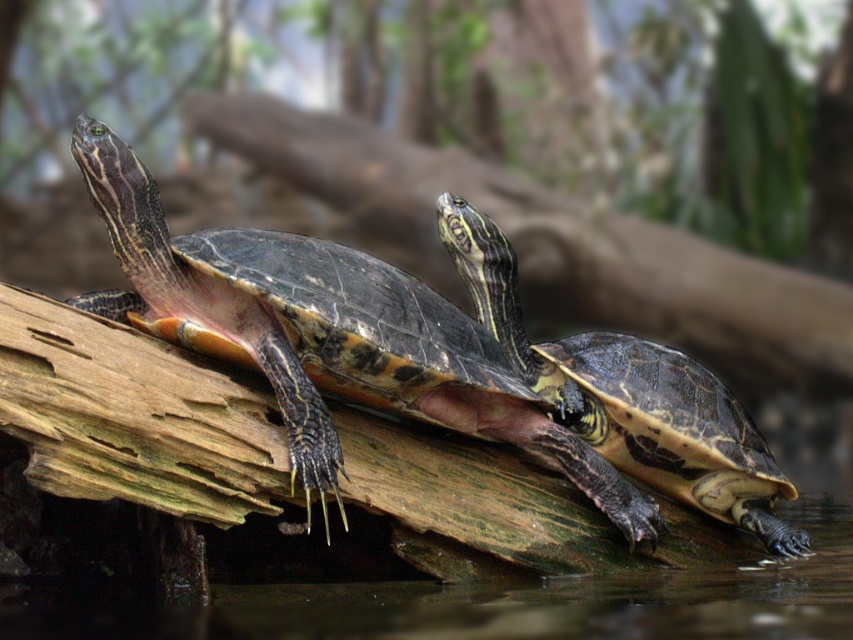
You are a photographer trying to capture both the shiny black turtle at left and the shiny black turtle at center in a single shot. Since the turtles are on the same log, can you adjust your camera focus to ensure both are in focus without moving the turtles?

The shiny black turtle at left is located above the shiny black turtle at center. Since they are stacked vertically on the log, adjusting the focus to the middle point between them might help both be in focus, but due to their positioning, some parts may still be slightly out of focus depending on the camera lens depth of field.

From the picture: You are a wildlife photographer aiming to capture the shiny black turtle at left in your shot. Based on the coordinates provided, where should you focus your camera to ensure the turtle is centered in the frame?

The shiny black turtle at left is located at coordinates point (x=343, y=332), so you should focus your camera there to center it in the frame.

You are standing at the center of the image. Which turtle is closer to the point at coordinates (343,332)?

The shiny black turtle at left is located at point (343,332), so it is the closest to that point.